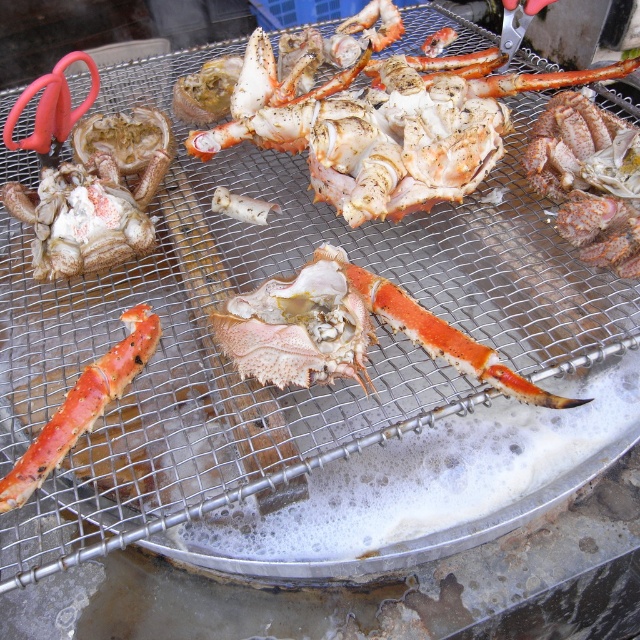
You are a chef preparing seafood. You need to access the speckled white lobster at center and the smooth orange crab leg at center. Which one is closer to you?

The speckled white lobster at center is closer to you because the smooth orange crab leg at center is behind it.

You are a chef preparing seafood. You have a speckled white lobster at center and a smooth orange crab leg at center on your grill. Which one requires more cooking time based on their size?

The speckled white lobster at center is bigger than the smooth orange crab leg at center, so it will require more cooking time.